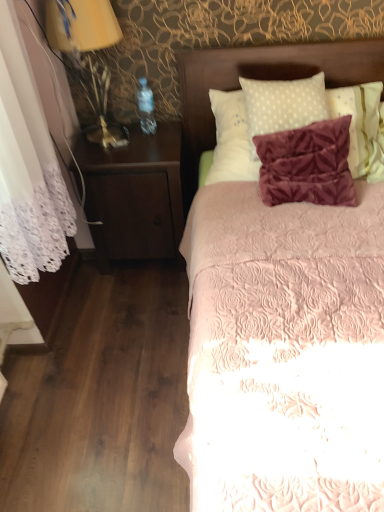
Locate an element on the screen. empty space that is ontop of dark wood nightstand at left (from a real-world perspective) is located at coordinates (128, 130).